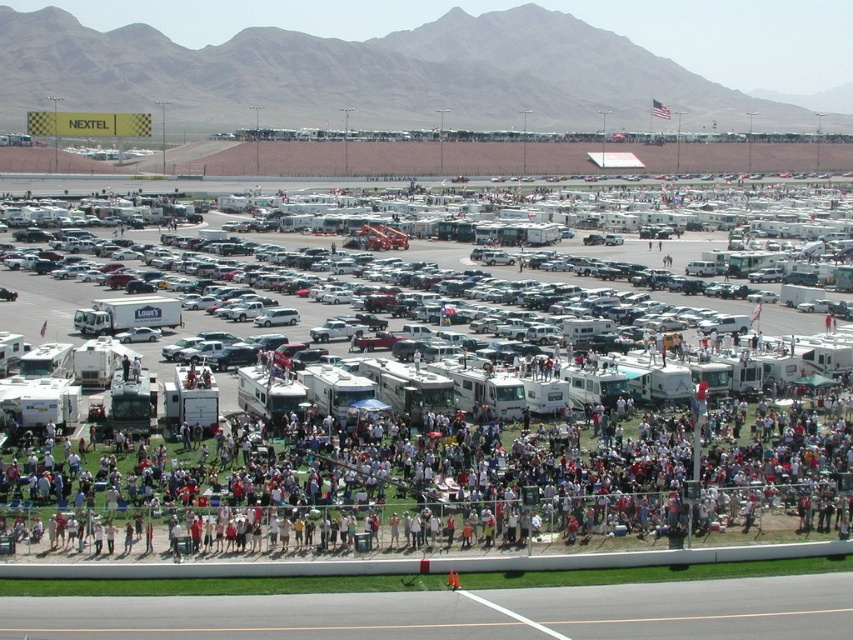
Question: Is white matte rv at center below white matte recreational vehicle at center?

Choices:
 (A) yes
 (B) no

Answer: (A)

Question: Which point is farther to the camera?

Choices:
 (A) white matte rv at center
 (B) white matte recreational vehicle at center

Answer: (B)

Question: Which point is closer to the camera?

Choices:
 (A) white matte recreational vehicle at center
 (B) white matte rv at center

Answer: (B)

Question: Is white matte rv at center to the left of white matte recreational vehicle at center from the viewer's perspective?

Choices:
 (A) yes
 (B) no

Answer: (B)

Question: Which of the following is the closest to the observer?

Choices:
 (A) white matte rv at center
 (B) white matte recreational vehicle at center

Answer: (A)

Question: Does white matte rv at center have a greater width compared to white matte recreational vehicle at center?

Choices:
 (A) yes
 (B) no

Answer: (A)